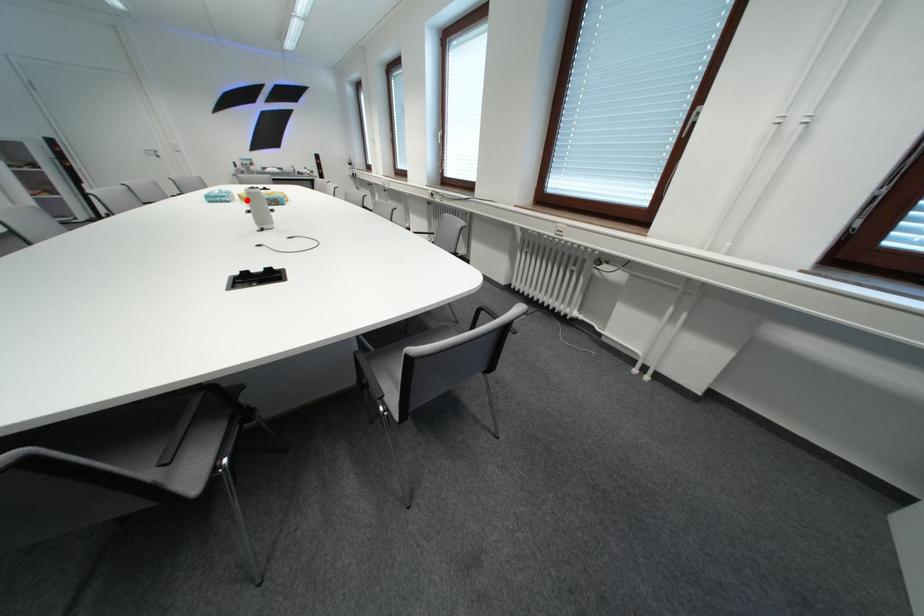
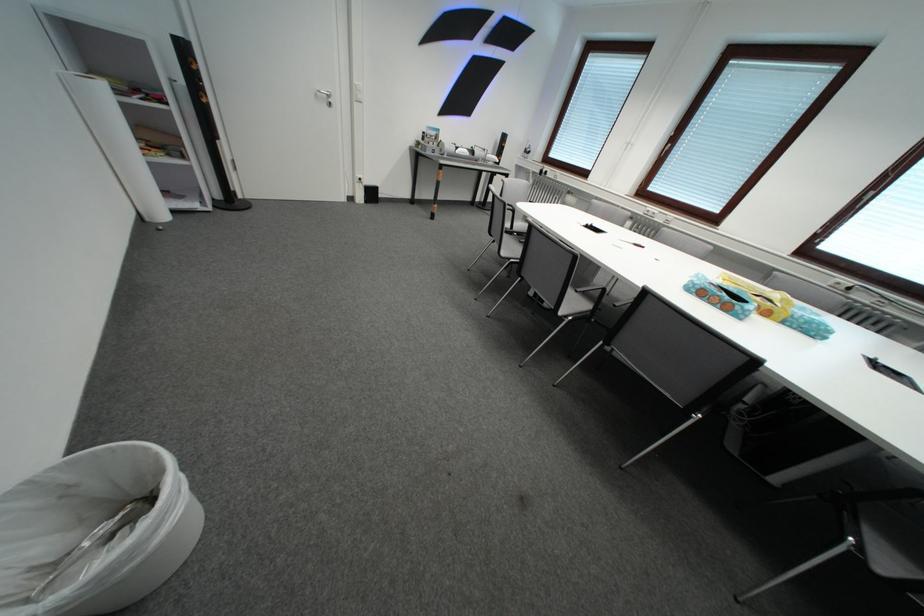
Question: I am providing you with two images of the same scene from different viewpoints. A red point is marked on the first image. Can you still see the location of the red point in image 2?

Choices:
 (A) Yes
 (B) No

Answer: (B)